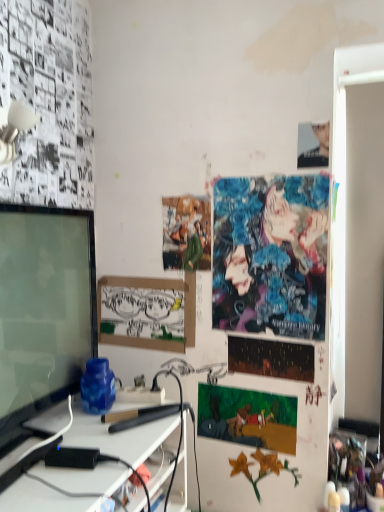
Question: Does dark matte poster at center, placed as the second poster page when sorted from bottom to top, have a smaller size compared to vibrant digital art at upper right, the 2th poster page in the top-to-bottom sequence?

Choices:
 (A) yes
 (B) no

Answer: (A)

Question: Could vibrant digital art at upper right, the third poster page positioned from the bottom, be considered to be inside dark matte poster at center, which is the 3th poster page in top-to-bottom order?

Choices:
 (A) yes
 (B) no

Answer: (B)

Question: From a real-world perspective, is dark matte poster at center, which is the 3th poster page in top-to-bottom order, positioned over vibrant digital art at upper right, the 2th poster page in the top-to-bottom sequence, based on gravity?

Choices:
 (A) yes
 (B) no

Answer: (B)

Question: Can you confirm if dark matte poster at center, placed as the second poster page when sorted from bottom to top, is positioned to the left of vibrant digital art at upper right, the 2th poster page in the top-to-bottom sequence?

Choices:
 (A) yes
 (B) no

Answer: (B)

Question: Does dark matte poster at center, which is the 3th poster page in top-to-bottom order, have a greater height compared to vibrant digital art at upper right, the 2th poster page in the top-to-bottom sequence?

Choices:
 (A) yes
 (B) no

Answer: (B)

Question: Can you confirm if dark matte poster at center, which is the 3th poster page in top-to-bottom order, is wider than vibrant digital art at upper right, the 2th poster page in the top-to-bottom sequence?

Choices:
 (A) no
 (B) yes

Answer: (A)

Question: From the image's perspective, is cartoon paper at center, arranged as the 1th poster page when ordered from the bottom, on top of smooth black shirt at upper right?

Choices:
 (A) yes
 (B) no

Answer: (B)

Question: Is cartoon paper at center, arranged as the 1th poster page when ordered from the bottom, at the right side of smooth black shirt at upper right?

Choices:
 (A) yes
 (B) no

Answer: (B)

Question: Is smooth black shirt at upper right at the back of cartoon paper at center, arranged as the 1th poster page when ordered from the bottom?

Choices:
 (A) no
 (B) yes

Answer: (A)

Question: Does cartoon paper at center, the 4th poster page when ordered from top to bottom, have a larger size compared to smooth black shirt at upper right?

Choices:
 (A) no
 (B) yes

Answer: (B)

Question: Is cartoon paper at center, the 4th poster page when ordered from top to bottom, completely or partially outside of smooth black shirt at upper right?

Choices:
 (A) no
 (B) yes

Answer: (B)

Question: Does cartoon paper at center, the 4th poster page when ordered from top to bottom, have a lesser height compared to smooth black shirt at upper right?

Choices:
 (A) yes
 (B) no

Answer: (B)

Question: Considering the relative sizes of matte black monitor at left and cartoon paper at center, arranged as the 1th poster page when ordered from the bottom, in the image provided, is matte black monitor at left thinner than cartoon paper at center, arranged as the 1th poster page when ordered from the bottom,?

Choices:
 (A) no
 (B) yes

Answer: (A)